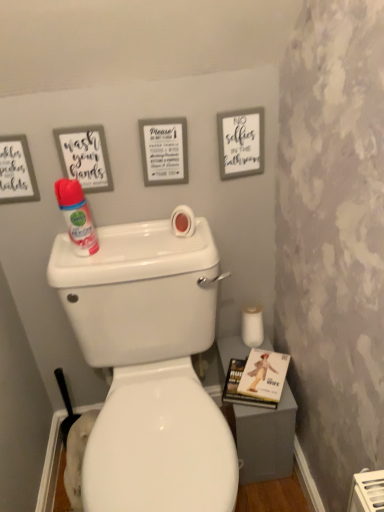
Question: Which is correct: matte white sign at upper center, arranged as the second picture frame when viewed from the left, is inside hardcover book at lower right, or outside of it?

Choices:
 (A) outside
 (B) inside

Answer: (A)

Question: In terms of width, does matte white sign at upper center, arranged as the second picture frame when viewed from the left, look wider or thinner when compared to hardcover book at lower right?

Choices:
 (A) thin
 (B) wide

Answer: (A)

Question: Based on their relative distances, which object is farther from the pink matte toilet paper at upper center, marked as the 2th toilet paper in a right-to-left arrangement?

Choices:
 (A) white matte toilet paper at lower right, the 1th toilet paper ordered from the bottom
 (B) matte white sign at upper center, which is the second picture frame from right to left
 (C) matte gray picture frame at upper left, positioned as the third picture frame in right-to-left order
 (D) white glossy toilet at center
 (E) white matte sign at upper right, the 3th picture frame positioned from the left

Answer: (A)

Question: Which of these objects is positioned closest to the white matte toilet paper at lower right, which is counted as the 1th toilet paper, starting from the back?

Choices:
 (A) white matte sign at upper right, the 3th picture frame positioned from the left
 (B) matte gray picture frame at upper left, positioned as the third picture frame in right-to-left order
 (C) matte white sign at upper center, arranged as the second picture frame when viewed from the left
 (D) pink matte toilet paper at upper center, which is counted as the first toilet paper, starting from the front
 (E) matte pink spray bottle at left

Answer: (D)